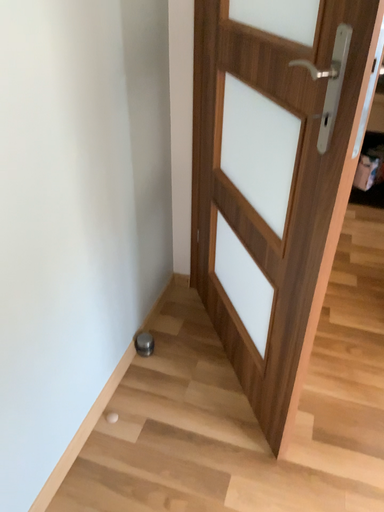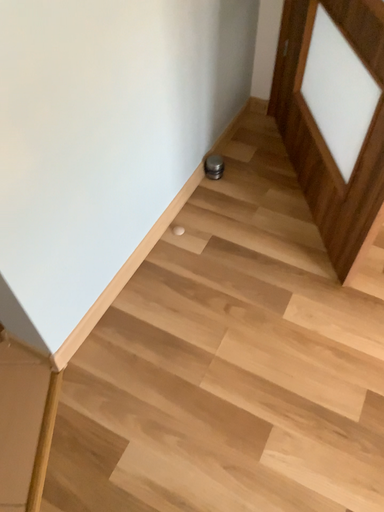
Question: Which way did the camera rotate in the video?

Choices:
 (A) rotated downward
 (B) rotated upward

Answer: (A)